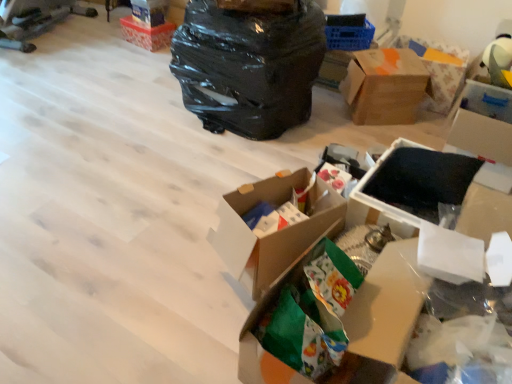
Identify the location of free point in front of brown cardboard box at upper right, the 4th box ordered from the bottom. (379, 132).